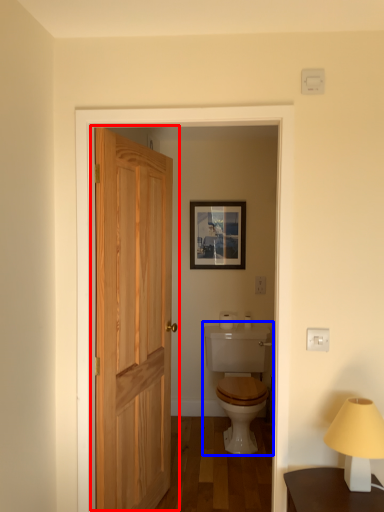
Question: Which object appears closest to the camera in this image, door (highlighted by a red box) or sink (highlighted by a blue box)?

Choices:
 (A) door
 (B) sink

Answer: (A)